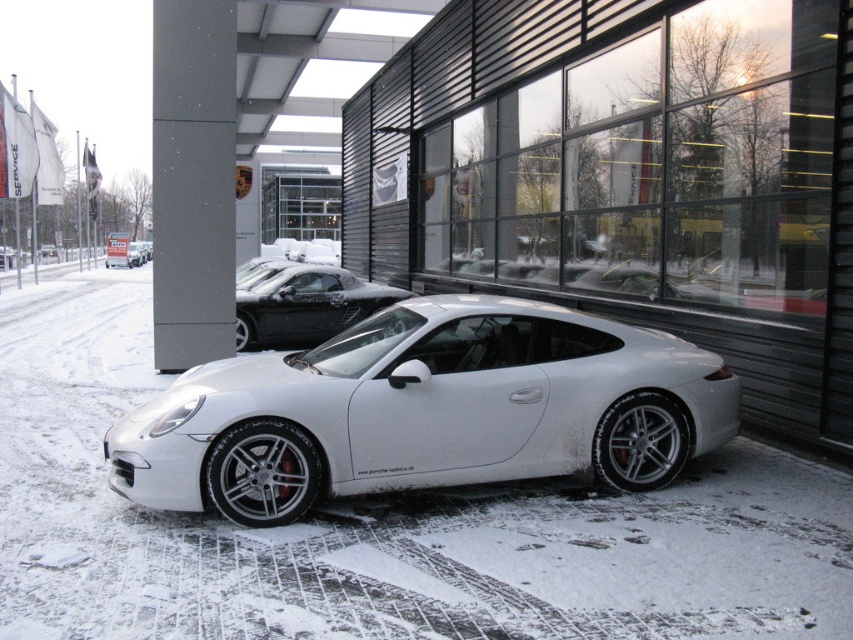
Between point (297, 458) and point (265, 314), which one is positioned in front?

Point (297, 458) is in front.

Between white metallic sports car at center and glossy black car at center, which one is positioned higher?

glossy black car at center

Measure the distance between white metallic sports car at center and camera.

white metallic sports car at center and camera are 4.55 meters apart.

The height and width of the screenshot is (640, 853). Identify the location of white metallic sports car at center. (426, 410).

Is white metallic sports car at center above white matte car at center?

No.

Who is lower down, white metallic sports car at center or white matte car at center?

white metallic sports car at center is lower down.

Between point (523, 416) and point (55, 256), which one is positioned behind?

The point (55, 256) is more distant.

The image size is (853, 640). Identify the location of white metallic sports car at center. (426, 410).

Is glossy black car at center smaller than white matte car at center?

Actually, glossy black car at center might be larger than white matte car at center.

Who is more forward, (300, 292) or (44, 253)?

Point (300, 292) is more forward.

At what (x,y) coordinates should I click in order to perform the action: click on glossy black car at center. Please return your answer as a coordinate pair (x, y). The height and width of the screenshot is (640, 853). Looking at the image, I should click on (305, 305).